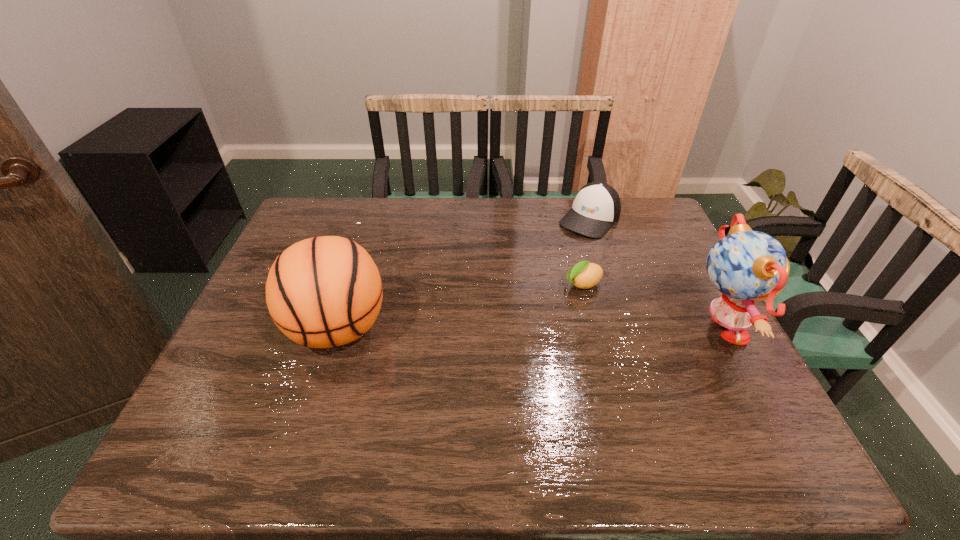
The image size is (960, 540). I want to click on vacant space at the right edge, so click(x=683, y=340).

In the image, there is a desktop. Identify the location of vacant space at the near left corner. The height and width of the screenshot is (540, 960). (226, 389).

Identify the location of free space at the far right corner of the desktop. The height and width of the screenshot is (540, 960). (621, 198).

This screenshot has width=960, height=540. Find the location of `empty location between the basketball and the lemon`. empty location between the basketball and the lemon is located at coordinates (461, 307).

Identify the location of vacant region between the rightmost object and the lemon. The height and width of the screenshot is (540, 960). (649, 309).

The image size is (960, 540). Find the location of `free spot between the lemon and the leftmost object`. free spot between the lemon and the leftmost object is located at coordinates (461, 307).

Find the location of `free space between the leftmost object and the lemon`. free space between the leftmost object and the lemon is located at coordinates (461, 307).

Find the location of a particular element. Image resolution: width=960 pixels, height=540 pixels. vacant point located between the rightmost object and the basketball is located at coordinates (526, 330).

Where is `vacant area between the shortest object and the second shortest object`? vacant area between the shortest object and the second shortest object is located at coordinates (587, 252).

I want to click on free space that is in between the farthest object and the doll, so click(x=652, y=276).